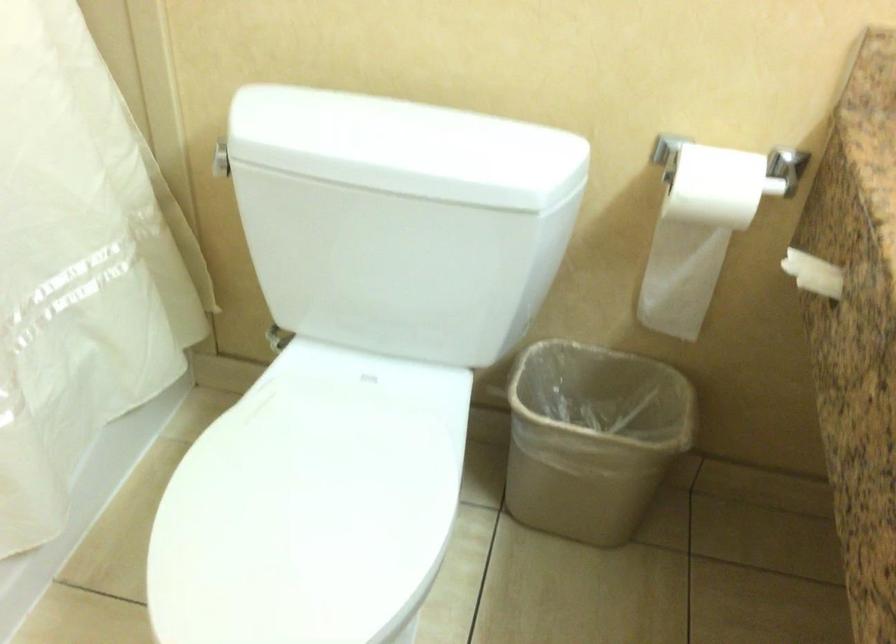
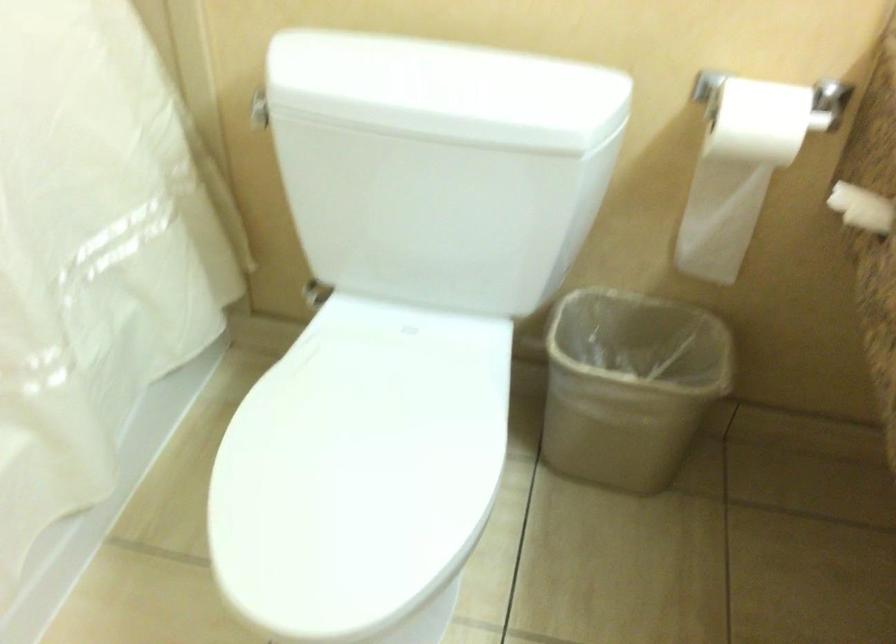
Question: What movement of the cameraman would produce the second image?

Choices:
 (A) Left
 (B) Right
 (C) Forward
 (D) Backward

Answer: (A)